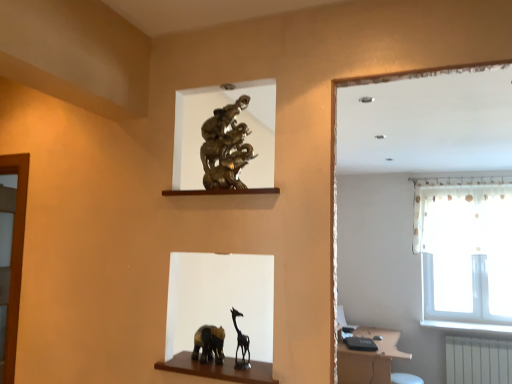
Question: Could you tell me if matte brown vanity at lower right is turned towards white sheer curtain at upper right?

Choices:
 (A) yes
 (B) no

Answer: (B)

Question: Is matte brown vanity at lower right located outside white sheer curtain at upper right?

Choices:
 (A) no
 (B) yes

Answer: (B)

Question: From a real-world perspective, is matte brown vanity at lower right below white sheer curtain at upper right?

Choices:
 (A) yes
 (B) no

Answer: (A)

Question: Is matte brown vanity at lower right not close to white sheer curtain at upper right?

Choices:
 (A) yes
 (B) no

Answer: (A)

Question: Can white sheer curtain at upper right be found inside matte brown vanity at lower right?

Choices:
 (A) no
 (B) yes

Answer: (A)

Question: Is matte brown vanity at lower right with white sheer curtain at upper right?

Choices:
 (A) yes
 (B) no

Answer: (B)

Question: Is white plastic radiator at lower right completely or partially outside of matte brown vanity at lower right?

Choices:
 (A) no
 (B) yes

Answer: (B)

Question: Does white plastic radiator at lower right have a lesser height compared to matte brown vanity at lower right?

Choices:
 (A) yes
 (B) no

Answer: (A)

Question: Is white plastic radiator at lower right wider than matte brown vanity at lower right?

Choices:
 (A) yes
 (B) no

Answer: (B)

Question: Can you confirm if white plastic radiator at lower right is smaller than matte brown vanity at lower right?

Choices:
 (A) no
 (B) yes

Answer: (B)

Question: From the image's perspective, would you say white plastic radiator at lower right is positioned over matte brown vanity at lower right?

Choices:
 (A) yes
 (B) no

Answer: (B)

Question: Would you consider white plastic radiator at lower right to be distant from matte brown vanity at lower right?

Choices:
 (A) yes
 (B) no

Answer: (A)

Question: Is white sheer curtain at upper right closer to the viewer compared to white plastic radiator at lower right?

Choices:
 (A) no
 (B) yes

Answer: (A)